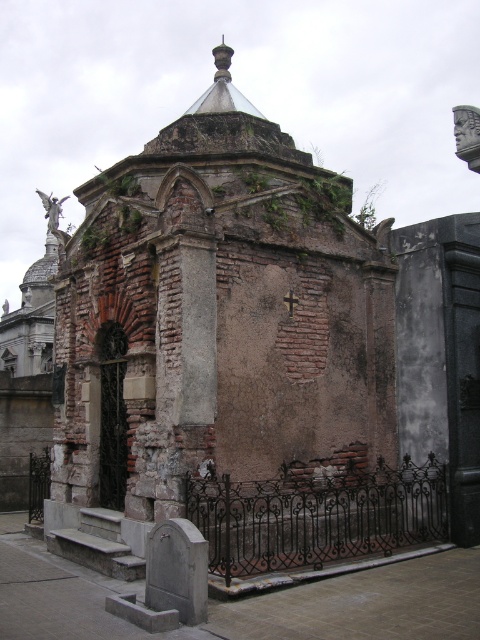
Question: Is black wrought iron fence at lower center above black wrought iron fence at lower left?

Choices:
 (A) yes
 (B) no

Answer: (A)

Question: Is black wrought iron fence at lower center to the right of black wrought iron fence at lower left from the viewer's perspective?

Choices:
 (A) yes
 (B) no

Answer: (A)

Question: Which of the following is the farthest from the observer?

Choices:
 (A) black wrought iron fence at lower center
 (B) black wrought iron fence at lower left

Answer: (B)

Question: Can you confirm if black wrought iron fence at lower center is positioned above black wrought iron fence at lower left?

Choices:
 (A) no
 (B) yes

Answer: (B)